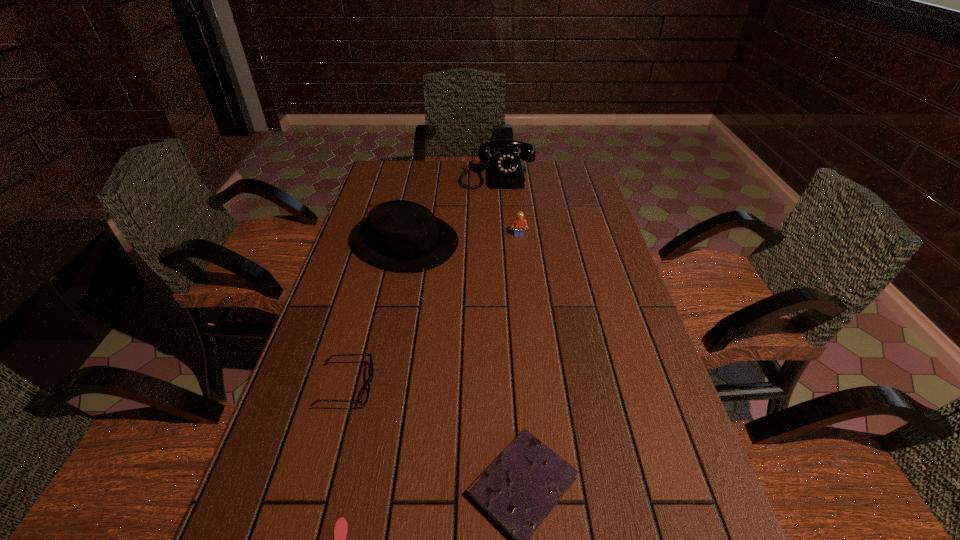
Find the location of a particular element. the tallest object is located at coordinates (506, 170).

In order to click on the farthest object in this screenshot , I will do `click(506, 170)`.

Image resolution: width=960 pixels, height=540 pixels. Find the location of `the second tallest object`. the second tallest object is located at coordinates (402, 235).

Locate an element on the screen. The height and width of the screenshot is (540, 960). the fourth shortest object is located at coordinates (518, 224).

Identify the location of the third nearest object. (365, 394).

I want to click on the third shortest object, so click(365, 394).

Where is `vacant space located on the dial of the telephone`? The width and height of the screenshot is (960, 540). vacant space located on the dial of the telephone is located at coordinates coord(501,251).

The image size is (960, 540). What are the coordinates of `free space located 0.230m on the front of the fedora` in the screenshot? It's located at point(384,336).

This screenshot has width=960, height=540. I want to click on vacant space located on the front-facing side of the third tallest object, so click(x=524, y=280).

Find the location of a particular element. This screenshot has width=960, height=540. free space located 0.060m on the front-facing side of the spectacles is located at coordinates (400, 387).